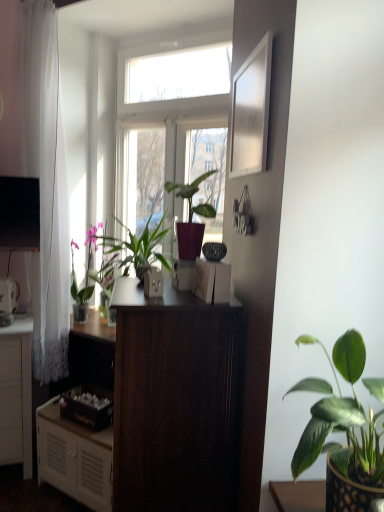
The height and width of the screenshot is (512, 384). In order to click on empty space that is ontop of transparent glass window at center (from a real-world perspective) in this screenshot , I will do `click(161, 24)`.